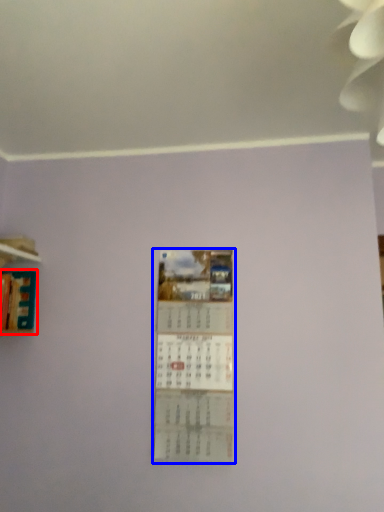
Question: Which point is closer to the camera, book (highlighted by a red box) or poster (highlighted by a blue box)?

Choices:
 (A) book
 (B) poster

Answer: (A)